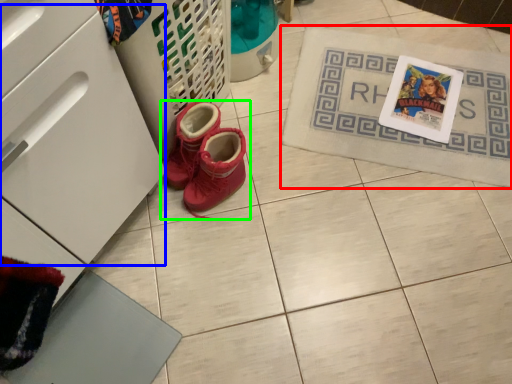
Question: Based on their relative distances, which object is farther from bath mat (highlighted by a red box)? Choose from drawer (highlighted by a blue box) and footwear (highlighted by a green box).

Choices:
 (A) drawer
 (B) footwear

Answer: (A)